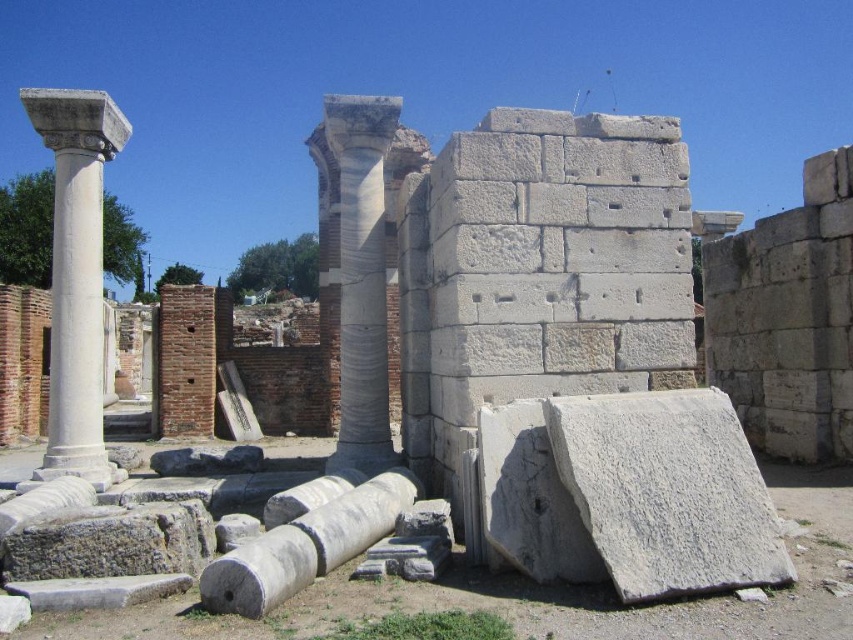
Is white marble column at left smaller than white marble column at center?

A: Actually, white marble column at left might be larger than white marble column at center.

Does point (111, 124) come farther from viewer compared to point (361, 368)?

No, (111, 124) is closer to viewer.

You are a GUI agent. You are given a task and a screenshot of the screen. Output one action in this format:
    pyautogui.click(x=<x>, y=<y>)
    Task: Click on the white marble column at left
    The image size is (853, 640).
    Given the screenshot: What is the action you would take?
    pyautogui.click(x=76, y=273)